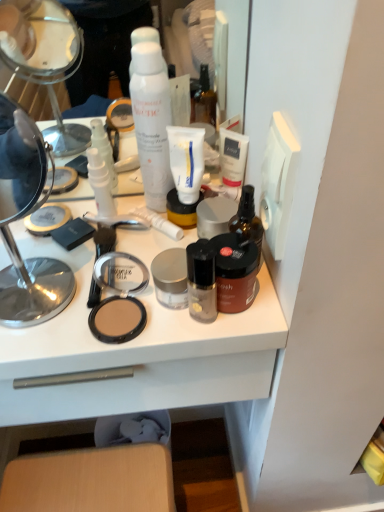
Where is `vacant space to the left of brown matte jar at center, which ranks as the 5th toiletry in left-to-right order`? vacant space to the left of brown matte jar at center, which ranks as the 5th toiletry in left-to-right order is located at coordinates (95, 301).